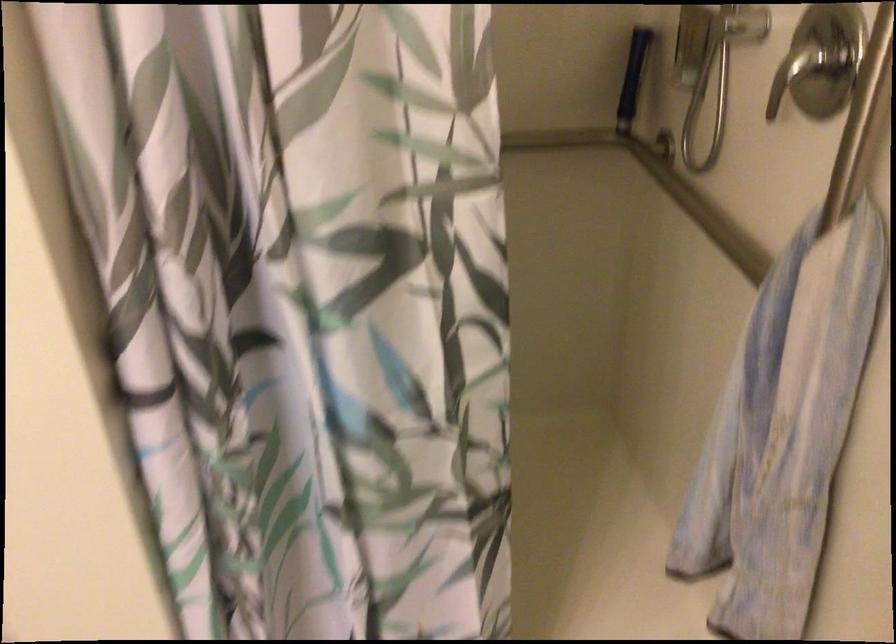
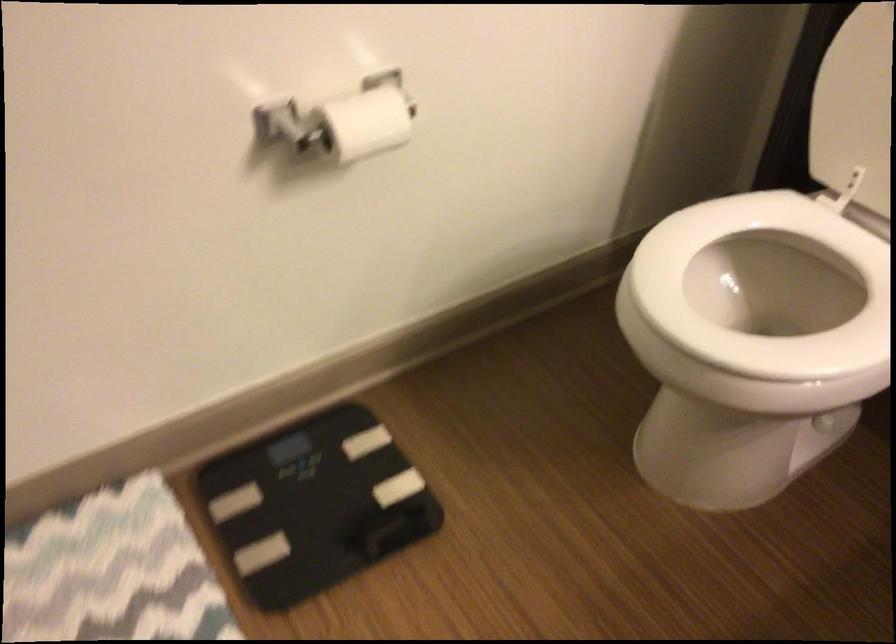
The first image is from the beginning of the video and the second image is from the end. How did the camera likely rotate when shooting the video?

The rotation direction of the camera is right-down.